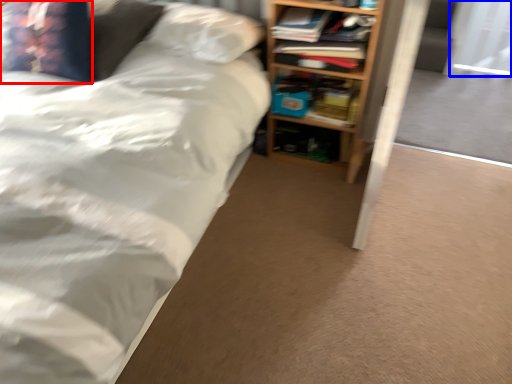
Question: Among these objects, which one is farthest to the camera, pillow (highlighted by a red box) or screen door (highlighted by a blue box)?

Choices:
 (A) pillow
 (B) screen door

Answer: (B)